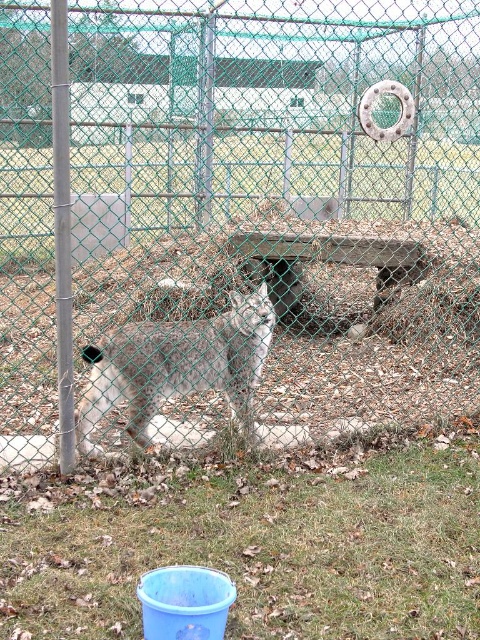
Question: Which object is closer to the camera taking this photo?

Choices:
 (A) green mesh fence at center
 (B) fuzzy gray lynx at center

Answer: (B)

Question: Does green mesh fence at center have a lesser width compared to fuzzy gray lynx at center?

Choices:
 (A) no
 (B) yes

Answer: (B)

Question: Is green mesh fence at center bigger than fuzzy gray lynx at center?

Choices:
 (A) no
 (B) yes

Answer: (A)

Question: Does green mesh fence at center have a lesser width compared to fuzzy gray lynx at center?

Choices:
 (A) no
 (B) yes

Answer: (B)

Question: Which of the following is the farthest from the observer?

Choices:
 (A) (464, 134)
 (B) (136, 376)

Answer: (A)